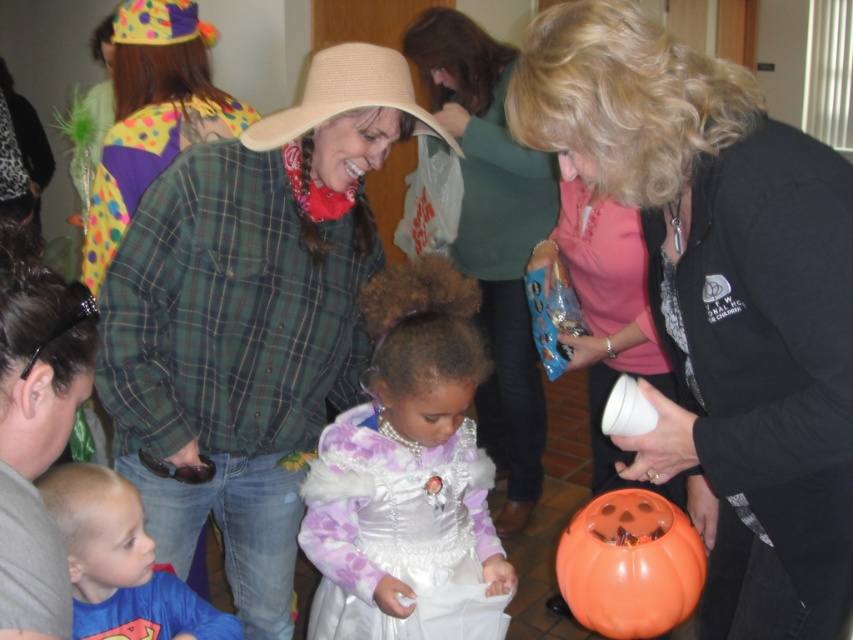
Between green plaid shirt at center and purple satin dress at center, which one appears on the right side from the viewer's perspective?

From the viewer's perspective, purple satin dress at center appears more on the right side.

Between point (190, 250) and point (354, 465), which one is positioned behind?

Point (354, 465)

The image size is (853, 640). Find the location of `green plaid shirt at center`. green plaid shirt at center is located at coordinates (250, 320).

Between matte green shirt at center and orange matte pumpkin at lower right, which one has less height?

Standing shorter between the two is orange matte pumpkin at lower right.

Which is in front, point (514, 385) or point (585, 577)?

Positioned in front is point (585, 577).

What do you see at coordinates (492, 237) in the screenshot? Image resolution: width=853 pixels, height=640 pixels. I see `matte green shirt at center` at bounding box center [492, 237].

The width and height of the screenshot is (853, 640). What are the coordinates of `matte green shirt at center` in the screenshot? It's located at (492, 237).

Is green plaid shirt at center smaller than matte green shirt at center?

Indeed, green plaid shirt at center has a smaller size compared to matte green shirt at center.

Who is more distant from viewer, (213, 168) or (480, 211)?

Point (480, 211)

The width and height of the screenshot is (853, 640). Identify the location of green plaid shirt at center. (250, 320).